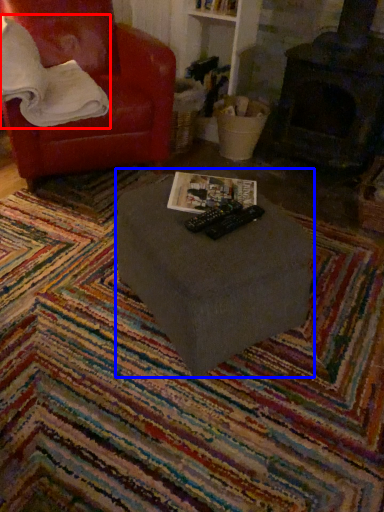
Question: Which object is further to the camera taking this photo, pillow (highlighted by a red box) or table (highlighted by a blue box)?

Choices:
 (A) pillow
 (B) table

Answer: (A)